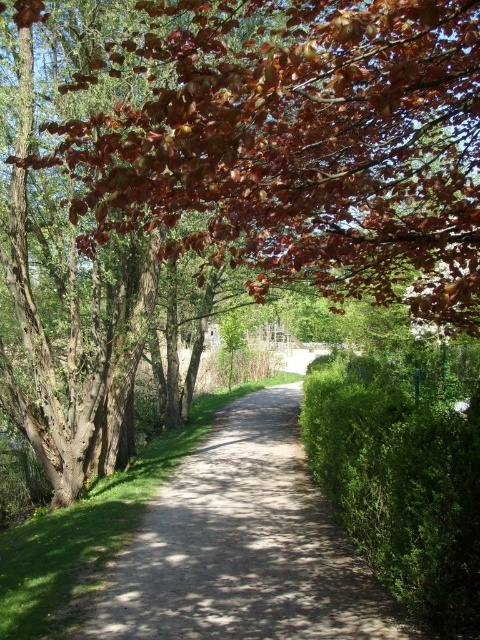
Is point (245, 13) less distant than point (338, 566)?

Yes.

Between brown leafy tree at upper left and dirt/gravel path at center, which one appears on the left side from the viewer's perspective?

Positioned to the left is brown leafy tree at upper left.

This screenshot has width=480, height=640. I want to click on brown leafy tree at upper left, so click(302, 147).

Locate an element on the screen. The image size is (480, 640). brown leafy tree at upper left is located at coordinates (302, 147).

Is point (275, 52) behind point (364, 540)?

No, (275, 52) is closer to viewer.

The width and height of the screenshot is (480, 640). I want to click on brown leafy tree at upper left, so click(302, 147).

Measure the distance between brown leafy tree at upper left and camera.

A distance of 3.82 meters exists between brown leafy tree at upper left and camera.

Find the location of a particular element. The image size is (480, 640). brown leafy tree at upper left is located at coordinates click(x=302, y=147).

Who is shorter, dirt/gravel path at center or green leafy hedge at right?

dirt/gravel path at center is shorter.

Who is more distant from viewer, (x=268, y=524) or (x=373, y=444)?

The point (x=268, y=524) is more distant.

Locate an element on the screen. dirt/gravel path at center is located at coordinates (242, 547).